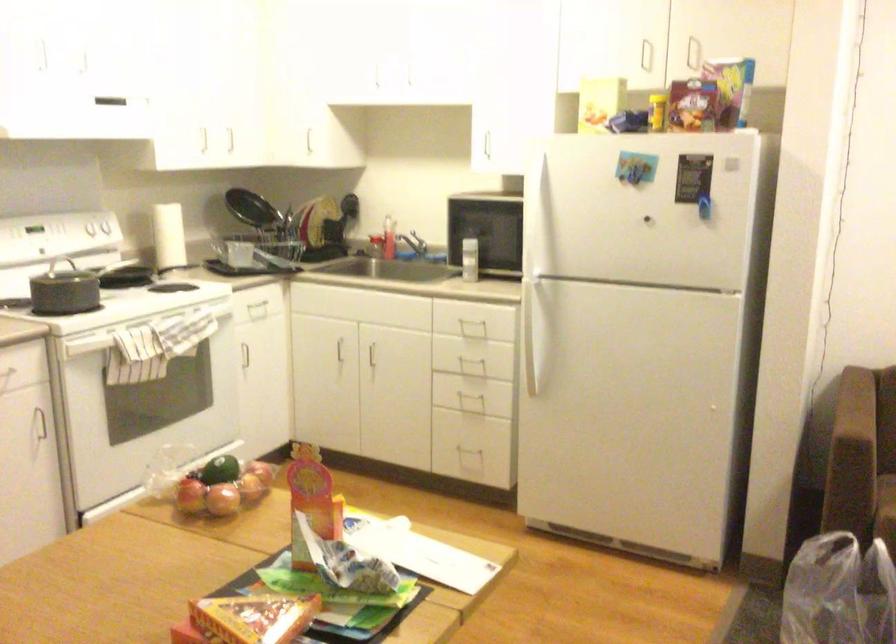
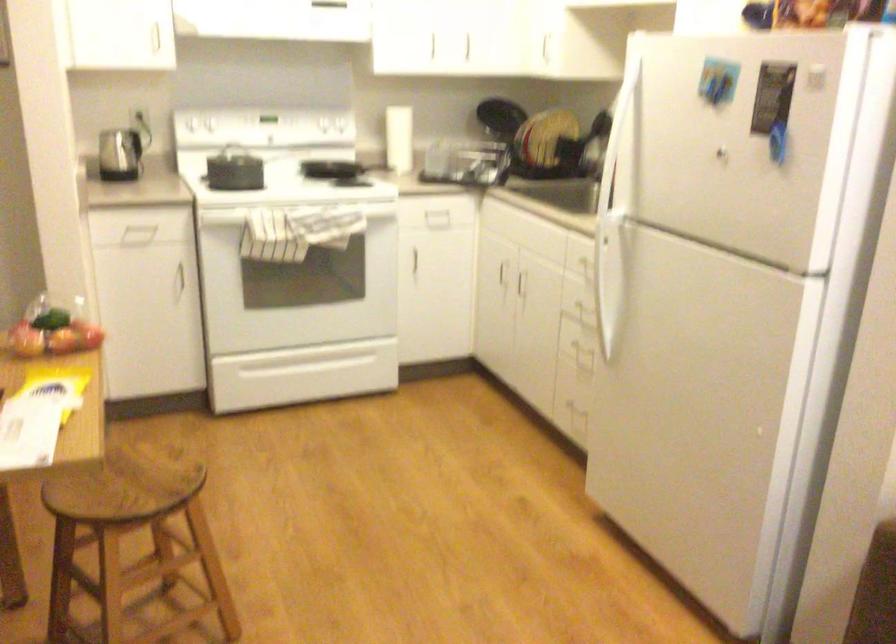
In the second image, find the point that corresponds to (160,384) in the first image.

(289, 261)